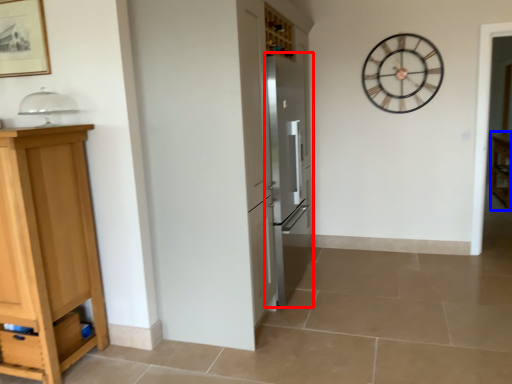
Question: Which point is closer to the camera, appliance (highlighted by a red box) or cabinetry (highlighted by a blue box)?

Choices:
 (A) appliance
 (B) cabinetry

Answer: (A)